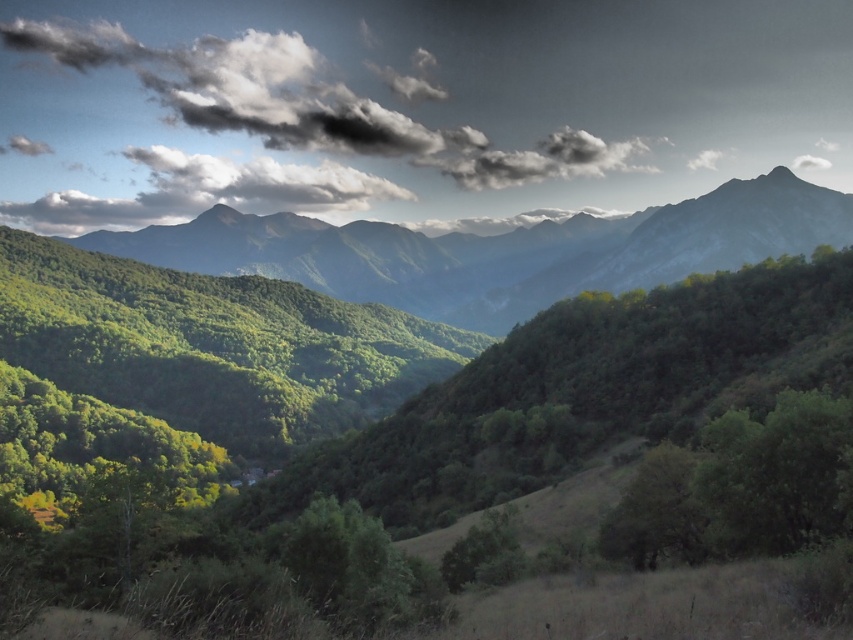
Question: Among these points, which one is farthest from the camera?

Choices:
 (A) (381, 609)
 (B) (59, 205)

Answer: (B)

Question: Does white fluffy cloud at upper center have a greater width compared to green matte tree at lower center?

Choices:
 (A) no
 (B) yes

Answer: (B)

Question: Among these objects, which one is nearest to the camera?

Choices:
 (A) green matte mountain range at center
 (B) green leafy tree at center
 (C) white fluffy cloud at upper center
 (D) green matte tree at lower center

Answer: (B)

Question: Does green matte mountain range at center appear over green matte tree at lower center?

Choices:
 (A) yes
 (B) no

Answer: (A)

Question: Among these objects, which one is farthest from the camera?

Choices:
 (A) green leafy tree at center
 (B) green matte mountain range at center
 (C) white fluffy cloud at upper center

Answer: (C)

Question: Is green matte mountain range at center wider than white fluffy cloud at upper center?

Choices:
 (A) no
 (B) yes

Answer: (B)